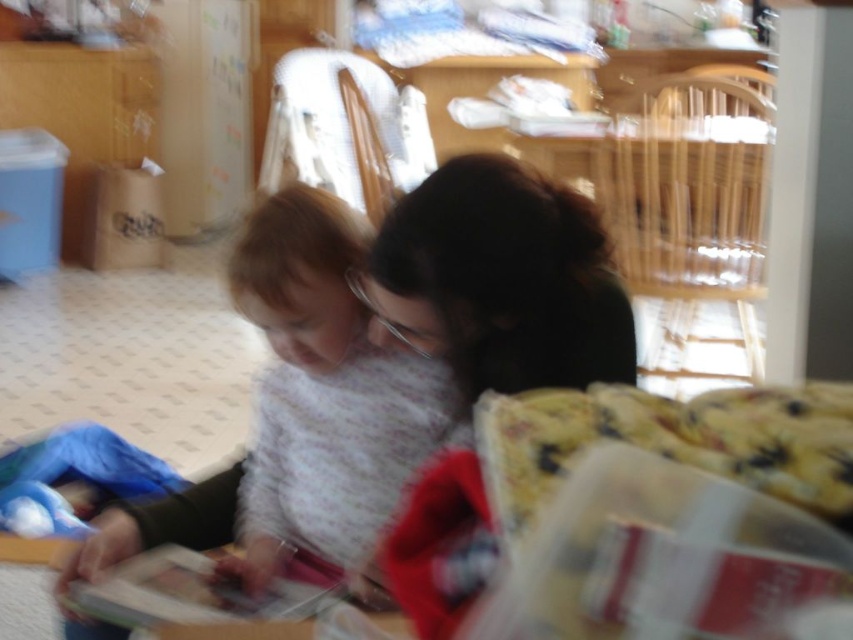
Looking at the scene where a child and an adult are together, can you tell me which sweater is positioned to the left between the fluffy white sweater at center and the dark green sweater at center?

The fluffy white sweater at center is positioned to the left of the dark green sweater at center.

You are helping organize a closet and see the fluffy white sweater at center and the dark green sweater at center. Which sweater is closer to you?

The fluffy white sweater at center is closer to you because the dark green sweater at center is behind it.